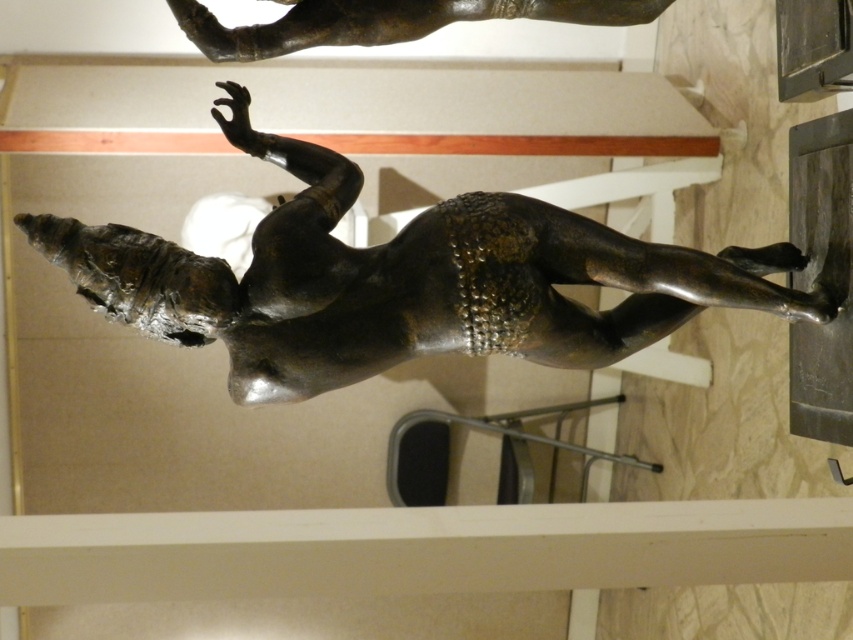
You are an art curator planning to install a new lighting system in the museum. You need to ensure that the bronze statue at center and the shiny bronze statue at upper center are both adequately lit. Given their sizes, which statue requires a brighter light to maintain visibility?

The bronze statue at center requires a brighter light because it has a greater height compared to the shiny bronze statue at upper center, and larger objects typically need more illumination to ensure all parts are visible.

You are an art conservator working in a museum. You need to place a protective barrier around the bronze statue at center and the shiny bronze statue at upper center. The barrier must be at least 14 inches away from each statue to ensure safety. Based on the current distance between them, will the statues be too close to each other for the barriers to be placed properly?

The bronze statue at center is 13.20 inches away from the shiny bronze statue at upper center. Since the required distance for the barriers is 14 inches, the current distance is insufficient. The statues are too close to allow proper placement of the barriers.

You are an art curator planning to install a new lighting system in the museum. You need to ensure that the light can reach both the bronze statue at center and the shiny bronze statue at upper center. Based on their positions, which statue requires a wider beam of light to illuminate properly?

The bronze statue at center requires a wider beam of light because it is wider than the shiny bronze statue at upper center according to the description.